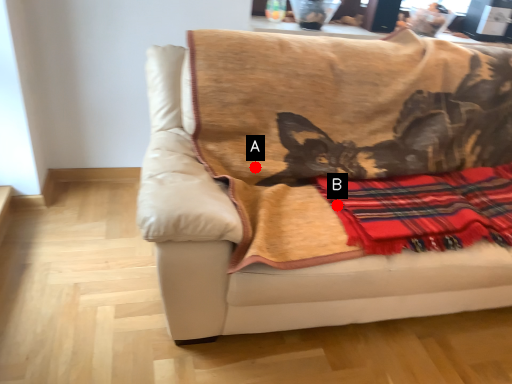
Question: Two points are circled on the image, labeled by A and B beside each circle. Among these points, which one is nearest to the camera?

Choices:
 (A) A is closer
 (B) B is closer

Answer: (B)